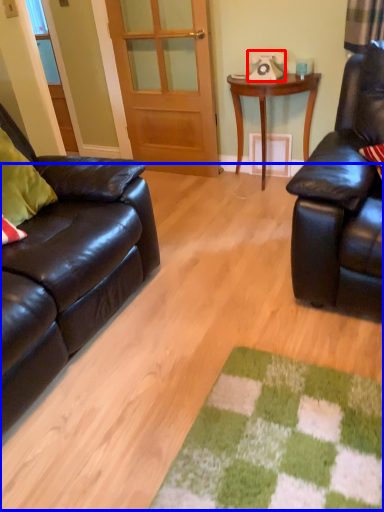
Question: Among these objects, which one is farthest to the camera, corded phone (highlighted by a red box) or plain (highlighted by a blue box)?

Choices:
 (A) corded phone
 (B) plain

Answer: (A)